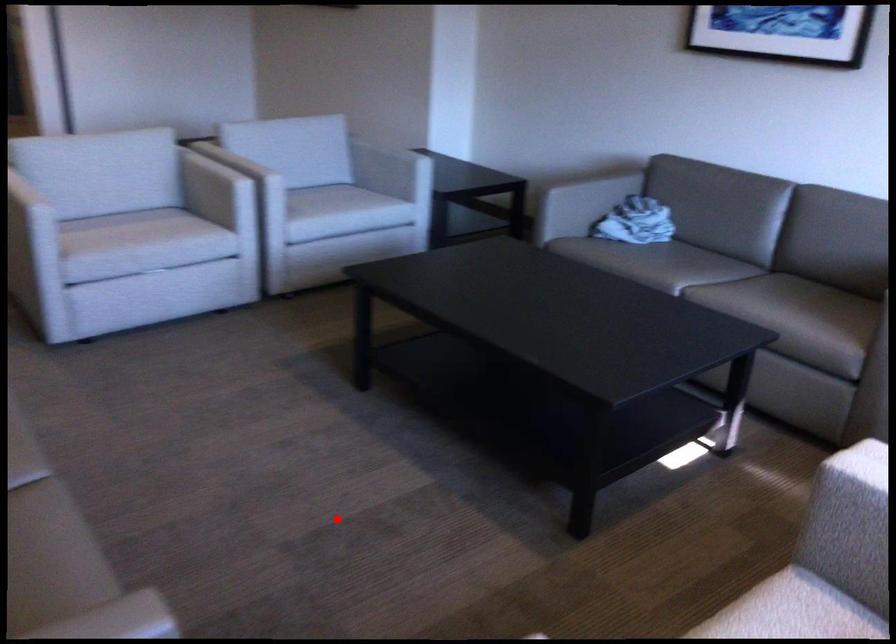
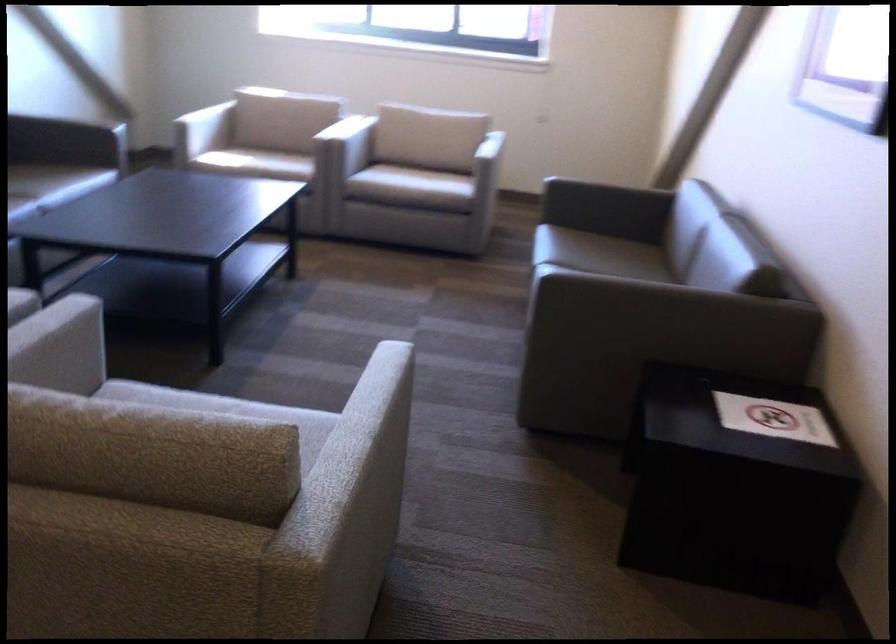
Question: I am providing you with two images of the same scene from different viewpoints. A red point is marked on the first image. At the location where the point appears in image 1, is it still visible in image 2?

Choices:
 (A) Yes
 (B) No

Answer: (A)